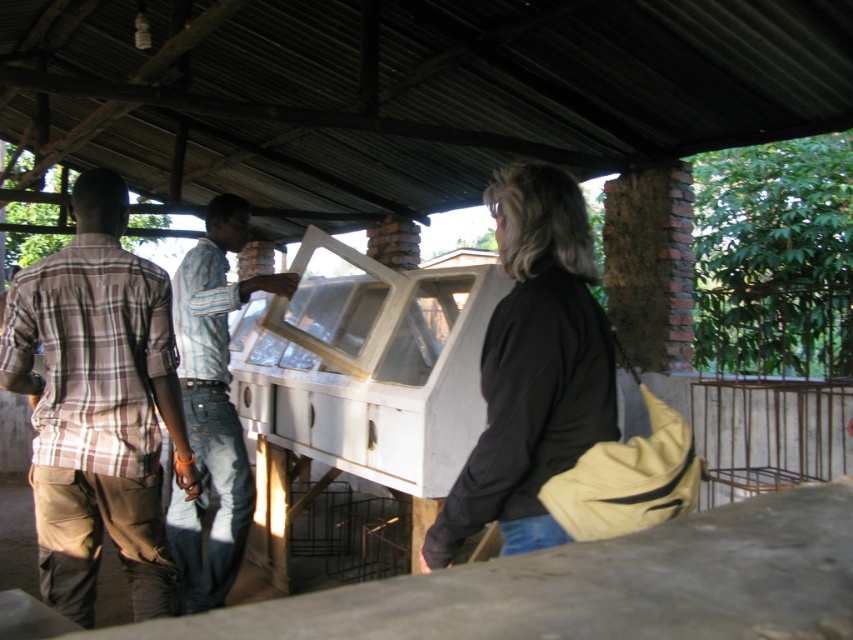
Question: Can you confirm if plaid cotton shirt at left is positioned below striped shirt at center?

Choices:
 (A) no
 (B) yes

Answer: (B)

Question: Observing the image, what is the correct spatial positioning of black matte jacket at center in reference to striped shirt at center?

Choices:
 (A) above
 (B) below

Answer: (A)

Question: Among these objects, which one is farthest from the camera?

Choices:
 (A) striped shirt at center
 (B) black matte jacket at center
 (C) plaid cotton shirt at left

Answer: (A)

Question: Considering the real-world distances, which object is closest to the black matte jacket at center?

Choices:
 (A) striped shirt at center
 (B) plaid cotton shirt at left

Answer: (B)

Question: Observing the image, what is the correct spatial positioning of black matte jacket at center in reference to striped shirt at center?

Choices:
 (A) left
 (B) right

Answer: (B)

Question: Which object is the farthest from the black matte jacket at center?

Choices:
 (A) striped shirt at center
 (B) plaid cotton shirt at left

Answer: (A)